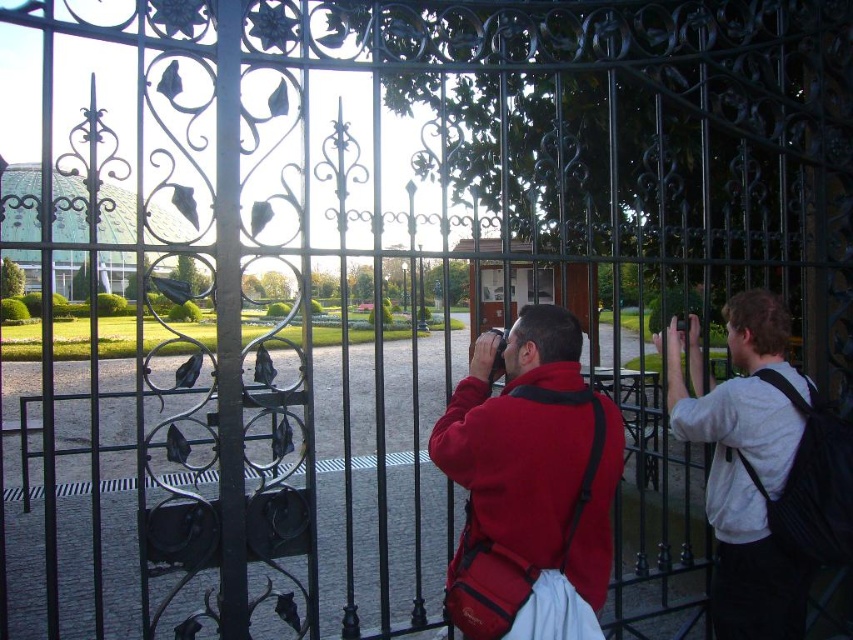
Question: Which point appears closest to the camera in this image?

Choices:
 (A) (688, 332)
 (B) (451, 422)
 (C) (492, 282)

Answer: (B)

Question: Can you confirm if matte red jacket at center is wider than white fabric at right?

Choices:
 (A) no
 (B) yes

Answer: (B)

Question: Which object is positioned farthest from the metallic glass door at center?

Choices:
 (A) matte red jacket at center
 (B) white fabric at right

Answer: (B)

Question: Is white fabric at right further to the viewer compared to metallic glass door at center?

Choices:
 (A) no
 (B) yes

Answer: (B)

Question: Considering the relative positions of matte red jacket at center and metallic glass door at center in the image provided, where is matte red jacket at center located with respect to metallic glass door at center?

Choices:
 (A) left
 (B) right

Answer: (A)

Question: Among these objects, which one is farthest from the camera?

Choices:
 (A) white fabric at right
 (B) metallic glass door at center

Answer: (A)